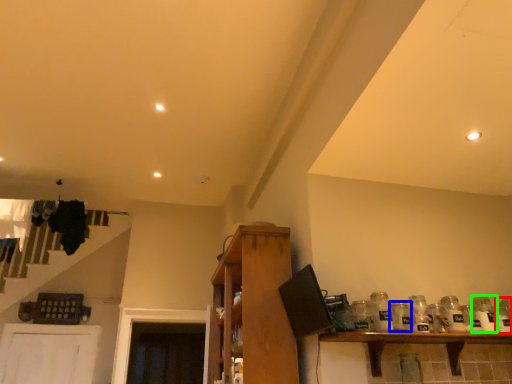
Question: Considering the real-world distances, which object is farthest from glass jar (highlighted by a red box)? glass jar (highlighted by a blue box) or glass bottle (highlighted by a green box)?

Choices:
 (A) glass jar
 (B) glass bottle

Answer: (A)